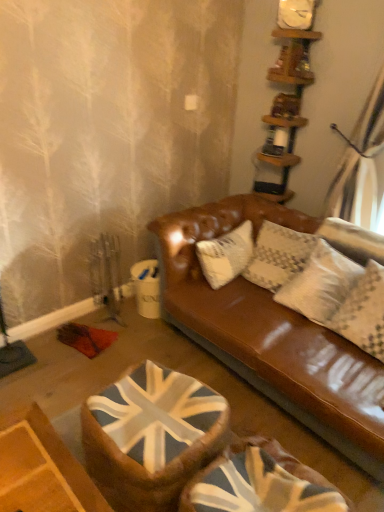
Question: Is wooden shelves at upper right positioned behind union jack fabric swivel chair at center, which ranks as the first swivel chair in left-to-right order?

Choices:
 (A) no
 (B) yes

Answer: (B)

Question: Could you tell me if wooden shelves at upper right is facing union jack fabric swivel chair at center, which ranks as the first swivel chair in left-to-right order?

Choices:
 (A) no
 (B) yes

Answer: (A)

Question: Is wooden shelves at upper right at the left side of union jack fabric swivel chair at center, positioned as the second swivel chair in right-to-left order?

Choices:
 (A) no
 (B) yes

Answer: (A)

Question: Does wooden shelves at upper right appear on the right side of union jack fabric swivel chair at center, which ranks as the first swivel chair in left-to-right order?

Choices:
 (A) no
 (B) yes

Answer: (B)

Question: From a real-world perspective, does wooden shelves at upper right sit lower than union jack fabric swivel chair at center, positioned as the second swivel chair in right-to-left order?

Choices:
 (A) yes
 (B) no

Answer: (B)

Question: Can you confirm if wooden shelves at upper right is bigger than union jack fabric swivel chair at center, which ranks as the first swivel chair in left-to-right order?

Choices:
 (A) yes
 (B) no

Answer: (B)

Question: Considering the relative sizes of wooden shelves at upper right and white textured pillow at upper right in the image provided, is wooden shelves at upper right wider than white textured pillow at upper right?

Choices:
 (A) yes
 (B) no

Answer: (A)

Question: Is wooden shelves at upper right closer to camera compared to white textured pillow at upper right?

Choices:
 (A) yes
 (B) no

Answer: (B)

Question: Is wooden shelves at upper right beside white textured pillow at upper right?

Choices:
 (A) no
 (B) yes

Answer: (A)

Question: Does wooden shelves at upper right come behind white textured pillow at upper right?

Choices:
 (A) no
 (B) yes

Answer: (B)

Question: Is wooden shelves at upper right at the left side of white textured pillow at upper right?

Choices:
 (A) no
 (B) yes

Answer: (B)

Question: Does wooden shelves at upper right appear on the right side of white textured pillow at upper right?

Choices:
 (A) no
 (B) yes

Answer: (A)

Question: Is white textured pillow at upper right shorter than union jack fabric swivel chair at lower center, which is the 2th swivel chair from left to right?

Choices:
 (A) no
 (B) yes

Answer: (B)